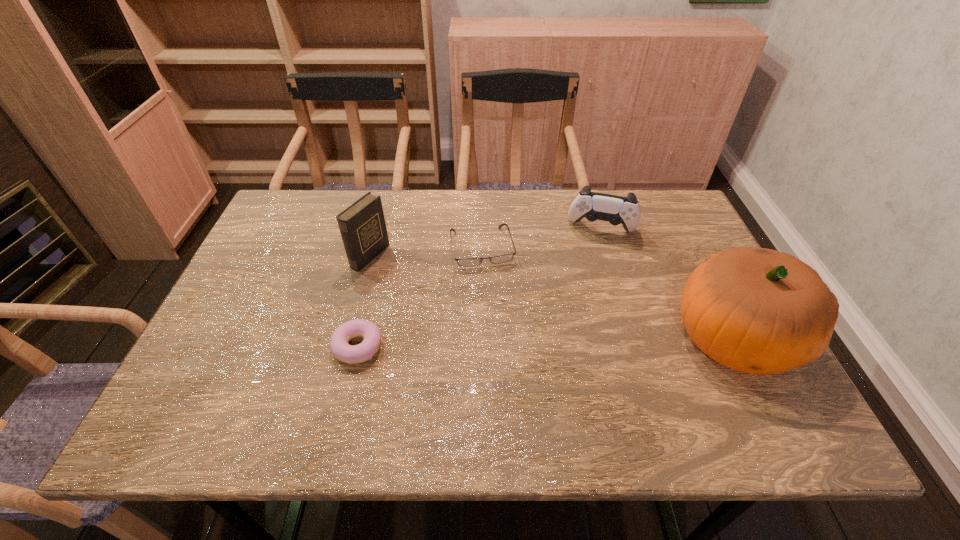
At what (x,y) coordinates should I click in order to perform the action: click on vacant space in between the doughnut and the tallest object. Please return your answer as a coordinate pair (x, y). Looking at the image, I should click on (546, 342).

Locate an element on the screen. Image resolution: width=960 pixels, height=540 pixels. free space between the diary and the doughnut is located at coordinates (364, 301).

What are the coordinates of `free spot between the tallest object and the third object from right to left` in the screenshot? It's located at (608, 293).

Locate an element on the screen. unoccupied area between the spectacles and the second tallest object is located at coordinates (426, 251).

Find the location of a particular element. The width and height of the screenshot is (960, 540). unoccupied position between the third tallest object and the doughnut is located at coordinates (480, 288).

The width and height of the screenshot is (960, 540). In order to click on empty location between the doughnut and the third tallest object in this screenshot , I will do `click(480, 288)`.

I want to click on free space between the tallest object and the doughnut, so click(x=546, y=342).

Identify which object is located as the nearest to the doughnut. Please provide its 2D coordinates. Your answer should be formatted as a tuple, i.e. [(x, y)], where the tuple contains the x and y coordinates of a point satisfying the conditions above.

[(362, 225)]

This screenshot has width=960, height=540. I want to click on object that stands as the third closest to the tallest object, so click(352, 354).

The width and height of the screenshot is (960, 540). Identify the location of free spot that satisfies the following two spatial constraints: 1. on the back side of the doughnut; 2. on the right side of the third shortest object. (386, 229).